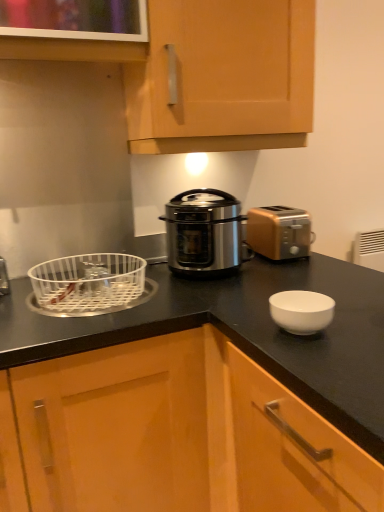
Question: From the image's perspective, relative to wooden cabinet at center, arranged as the 1th cabinetry when ordered from the bottom, is white plastic basket at left above or below?

Choices:
 (A) below
 (B) above

Answer: (B)

Question: Considering the positions of white plastic basket at left and wooden cabinet at center, which ranks as the 2th cabinetry in top-to-bottom order, in the image, is white plastic basket at left taller or shorter than wooden cabinet at center, which ranks as the 2th cabinetry in top-to-bottom order,?

Choices:
 (A) tall
 (B) short

Answer: (B)

Question: Estimate the real-world distances between objects in this image. Which object is farther from the stainless steel pressure cooker at center?

Choices:
 (A) light wood cabinet at upper center, which is the 1th cabinetry from top to bottom
 (B) white plastic basket at left
 (C) gold metallic toaster at right
 (D) wooden cabinet at center, arranged as the 1th cabinetry when ordered from the bottom

Answer: (D)

Question: Estimate the real-world distances between objects in this image. Which object is closer to the light wood cabinet at upper center, which is the 1th cabinetry from top to bottom?

Choices:
 (A) wooden cabinet at center, which ranks as the 2th cabinetry in top-to-bottom order
 (B) stainless steel pressure cooker at center
 (C) white plastic basket at left
 (D) gold metallic toaster at right

Answer: (B)